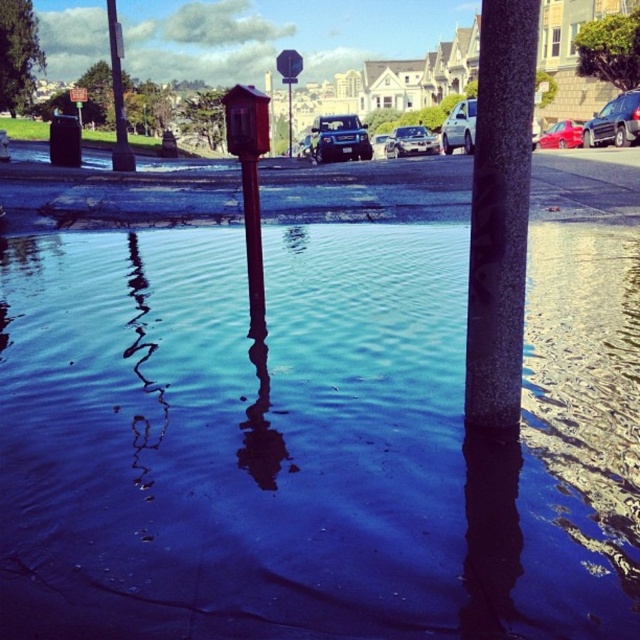
Question: Among these points, which one is nearest to the camera?

Choices:
 (A) (580, 131)
 (B) (627, 99)

Answer: (B)

Question: In this image, where is metallic red parking meter at center located relative to shiny red sedan at center?

Choices:
 (A) left
 (B) right

Answer: (A)

Question: Is granite gray pole at center wider than metallic silver suv at center?

Choices:
 (A) yes
 (B) no

Answer: (B)

Question: Among these points, which one is farthest from the camera?

Choices:
 (A) (352, 150)
 (B) (468, 141)

Answer: (A)

Question: Is granite gray pole at center bigger than metallic silver suv at center?

Choices:
 (A) yes
 (B) no

Answer: (B)

Question: Which of these objects is positioned farthest from the metallic red parking meter at center?

Choices:
 (A) satin black suv at upper right
 (B) shiny red sedan at center
 (C) silver metallic sedan at center
 (D) brushed metal pole at upper left

Answer: (B)